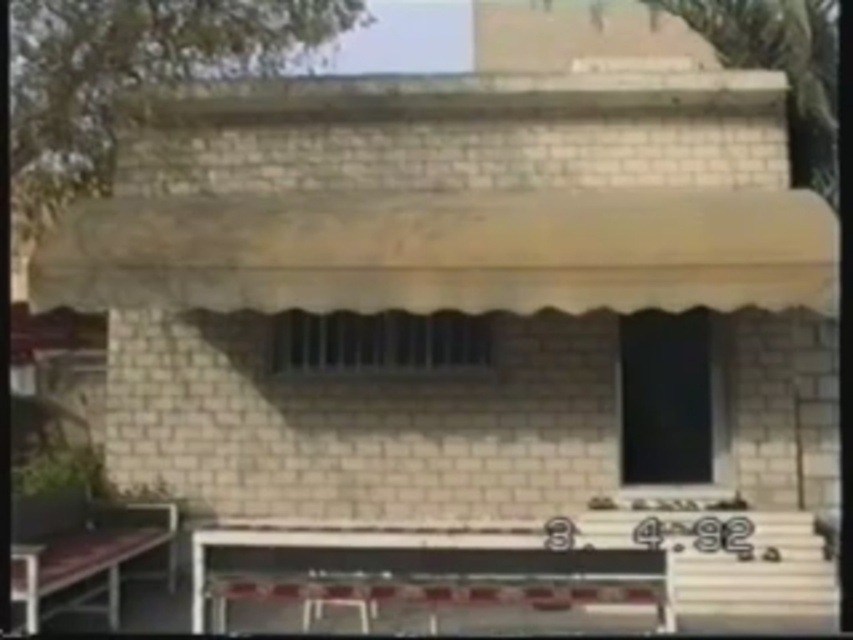
From the picture: You are planning to host a small gathering and need to seat 6 people. You have access to both the white plastic picnic table at lower center and the wooden park bench at lower left. Which object would be more suitable for seating more people, and why?

The white plastic picnic table at lower center is more suitable for seating more people because its width surpasses that of the wooden park bench at lower left, providing more seating space.

Looking at this image, you are a maintenance worker who needs to move a 1.2 meter long ladder from the white plastic picnic table at lower center to the wooden park bench at lower left. Is there enough space to move it without bending the ladder?

The distance between the white plastic picnic table at lower center and the wooden park bench at lower left is 1.12 meters. Since the ladder is 1.2 meters long, it is longer than the available space. Therefore, you will need to bend the ladder to move it.